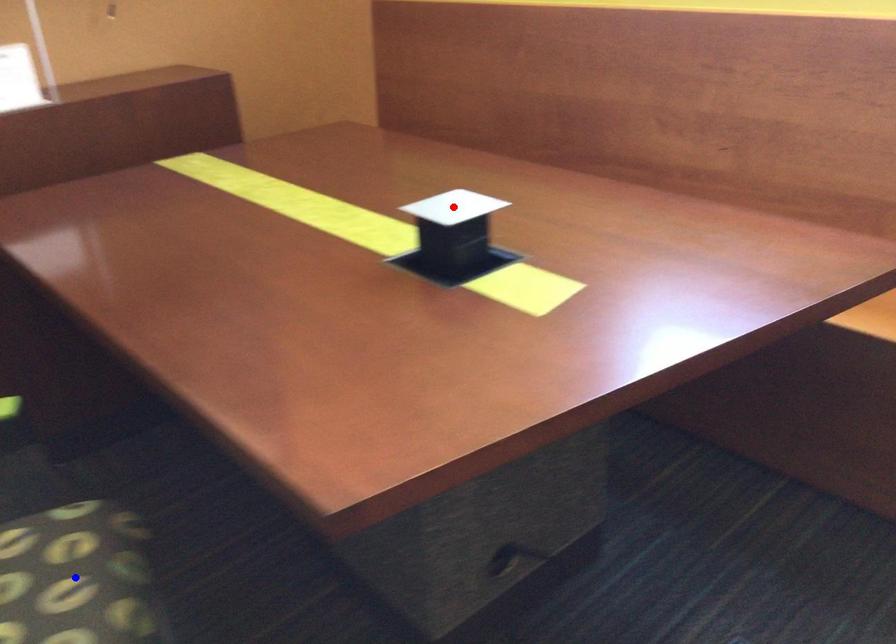
Question: In the image, two points are highlighted. Which point is nearer to the camera? Reply with the corresponding letter.

Choices:
 (A) blue point
 (B) red point

Answer: (A)